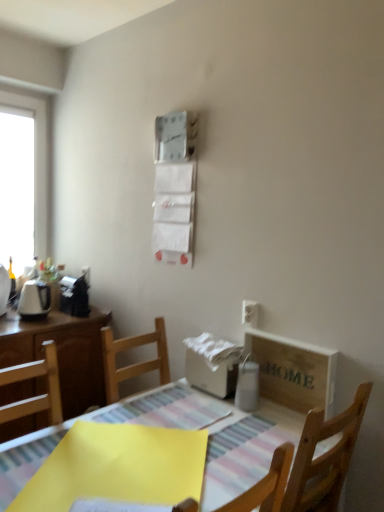
Question: Is yellow paper at lower left placed right next to white glossy window at left?

Choices:
 (A) yes
 (B) no

Answer: (B)

Question: Is yellow paper at lower left positioned beyond the bounds of white glossy window at left?

Choices:
 (A) yes
 (B) no

Answer: (A)

Question: Is yellow paper at lower left looking in the opposite direction of white glossy window at left?

Choices:
 (A) yes
 (B) no

Answer: (B)

Question: Is yellow paper at lower left thinner than white glossy window at left?

Choices:
 (A) no
 (B) yes

Answer: (A)

Question: Does yellow paper at lower left have a larger size compared to white glossy window at left?

Choices:
 (A) no
 (B) yes

Answer: (A)

Question: From a real-world perspective, is yellow paper at lower left positioned over white glossy window at left based on gravity?

Choices:
 (A) yes
 (B) no

Answer: (B)

Question: Does white paper towel at center have a lesser width compared to white plastic electric outlet at upper right?

Choices:
 (A) yes
 (B) no

Answer: (B)

Question: Is white paper towel at center directly adjacent to white plastic electric outlet at upper right?

Choices:
 (A) no
 (B) yes

Answer: (A)

Question: Is white paper towel at center aimed at white plastic electric outlet at upper right?

Choices:
 (A) no
 (B) yes

Answer: (A)

Question: Is white plastic electric outlet at upper right at the back of white paper towel at center?

Choices:
 (A) yes
 (B) no

Answer: (B)

Question: From the image's perspective, is white paper towel at center located beneath white plastic electric outlet at upper right?

Choices:
 (A) no
 (B) yes

Answer: (B)

Question: Considering the relative sizes of white paper towel at center and white plastic electric outlet at upper right in the image provided, is white paper towel at center taller than white plastic electric outlet at upper right?

Choices:
 (A) yes
 (B) no

Answer: (B)

Question: Is white glossy window at left positioned beyond the bounds of wooden crate at lower right?

Choices:
 (A) no
 (B) yes

Answer: (B)